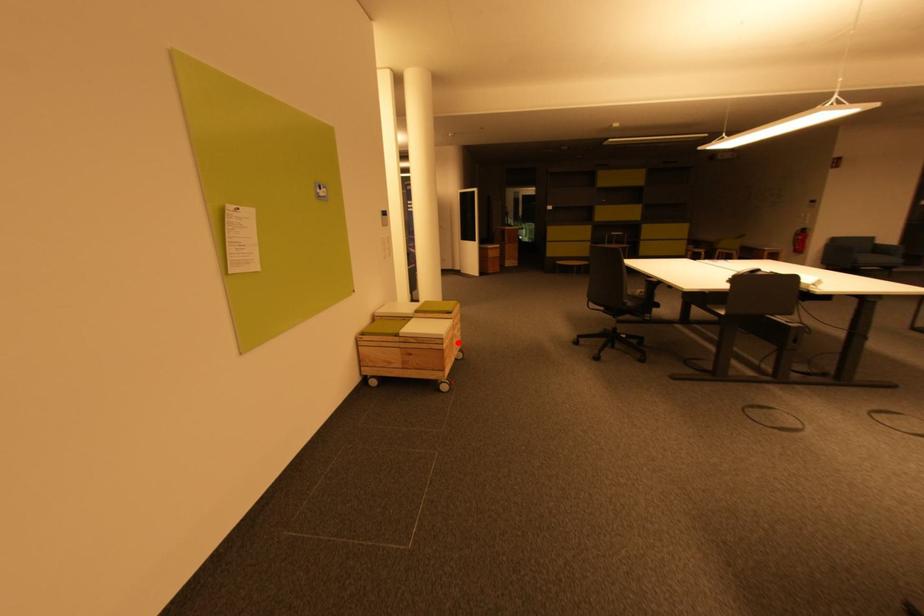
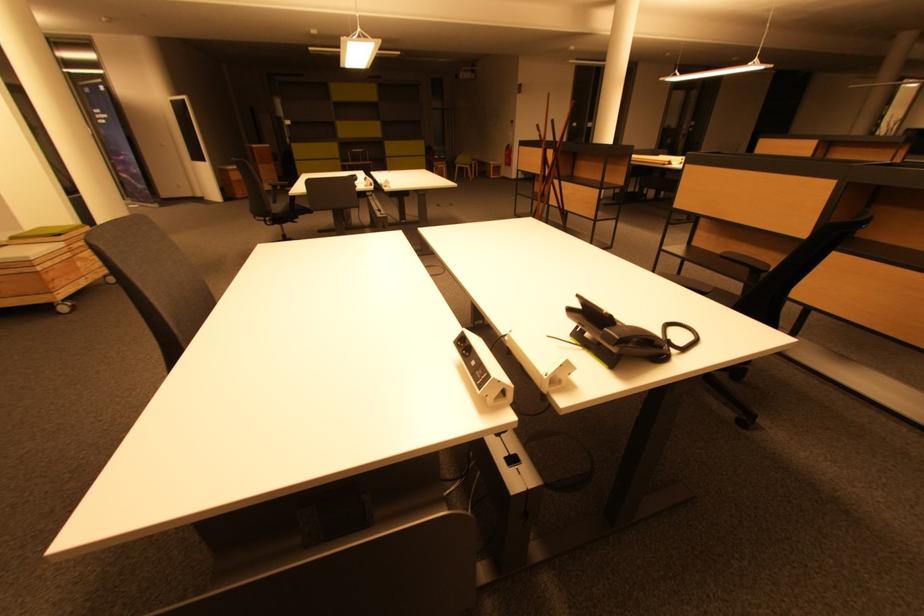
Question: I am providing you with two images of the same scene from different viewpoints. Given a red point in image1, look at the same physical point in image2. Is it:

Choices:
 (A) Closer to the viewpoint
 (B) Farther from the viewpoint

Answer: (B)